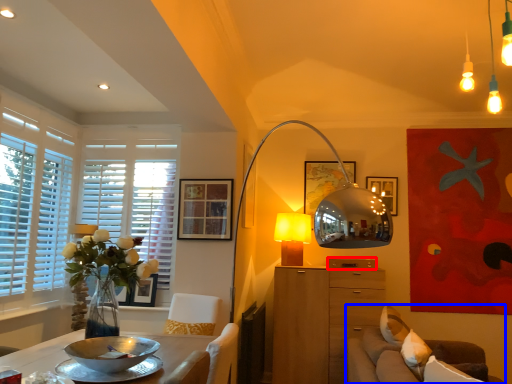
Question: Which object is closer to the camera taking this photo, drawer (highlighted by a red box) or studio couch (highlighted by a blue box)?

Choices:
 (A) drawer
 (B) studio couch

Answer: (B)